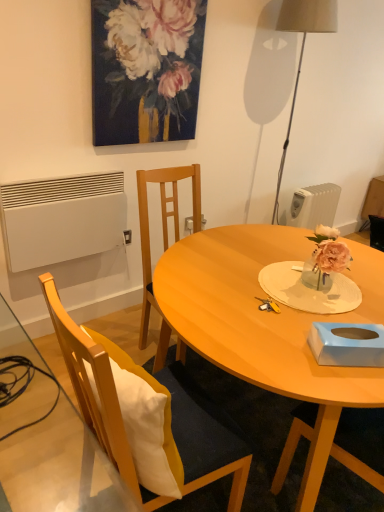
Question: Is oil paint canvas at upper center in front of or behind blue cardboard tissue box at lower right in the image?

Choices:
 (A) behind
 (B) front

Answer: (A)

Question: Is oil paint canvas at upper center to the left or to the right of blue cardboard tissue box at lower right in the image?

Choices:
 (A) right
 (B) left

Answer: (B)

Question: Which object is the closest to the wooden chair at left?

Choices:
 (A) white plastic radiator at right, marked as the 1th radiator in a back-to-front arrangement
 (B) matte wood table at center
 (C) white matte radiator at lower left, which is the first radiator in front-to-back order
 (D) blue cardboard tissue box at lower right
 (E) oil paint canvas at upper center

Answer: (B)

Question: Considering the real-world distances, which object is closest to the blue cardboard tissue box at lower right?

Choices:
 (A) white plastic radiator at right, the 1th radiator viewed from the right
 (B) white matte radiator at lower left, the second radiator positioned from the back
 (C) matte wood table at center
 (D) wooden chair at left
 (E) oil paint canvas at upper center

Answer: (C)